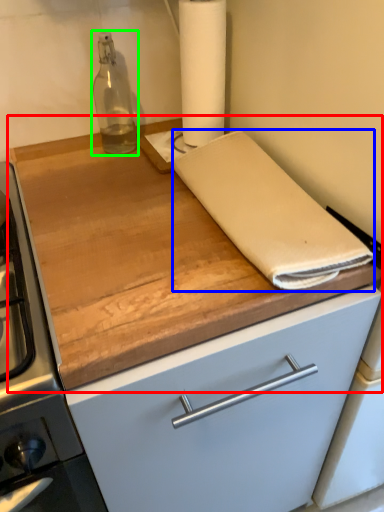
Question: Estimate the real-world distances between objects in this image. Which object is farther from countertop (highlighted by a red box), linen (highlighted by a blue box) or bottle (highlighted by a green box)?

Choices:
 (A) linen
 (B) bottle

Answer: (B)